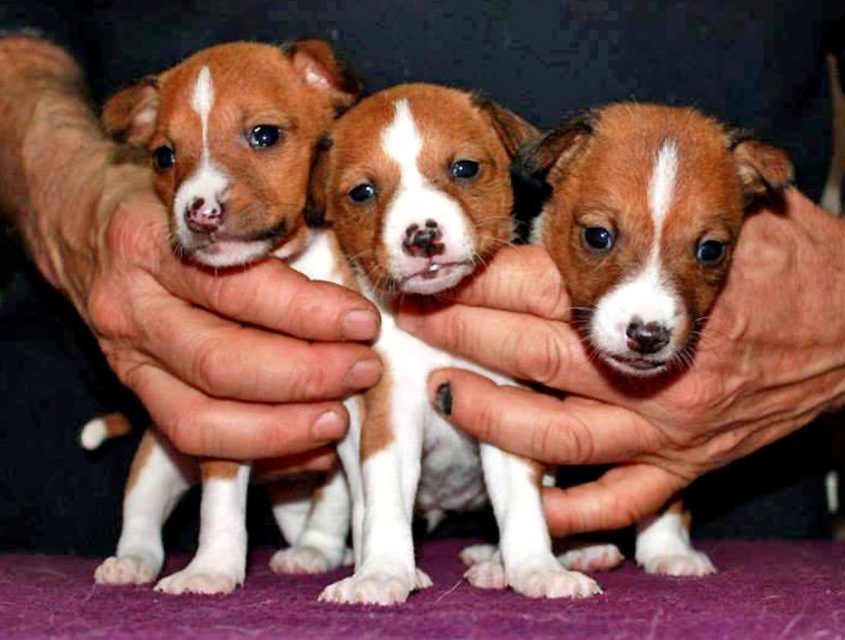
Question: In this image, where is smooth skin hand at center located relative to brown furry puppy at center?

Choices:
 (A) below
 (B) above

Answer: (A)

Question: Does smooth skin hand at center have a greater width compared to smooth skin hand at left?

Choices:
 (A) yes
 (B) no

Answer: (B)

Question: Based on their relative distances, which object is nearer to the smooth skin hand at left?

Choices:
 (A) brown furry puppy at center
 (B) smooth skin hand at center

Answer: (B)

Question: Is smooth skin hand at left above brown furry puppy at center?

Choices:
 (A) no
 (B) yes

Answer: (B)

Question: Which of the following is the farthest from the observer?

Choices:
 (A) (7, 35)
 (B) (631, 317)
 (C) (804, 205)

Answer: (A)

Question: Which point is farther from the camera taking this photo?

Choices:
 (A) (292, 404)
 (B) (615, 524)
 (C) (696, 300)

Answer: (B)